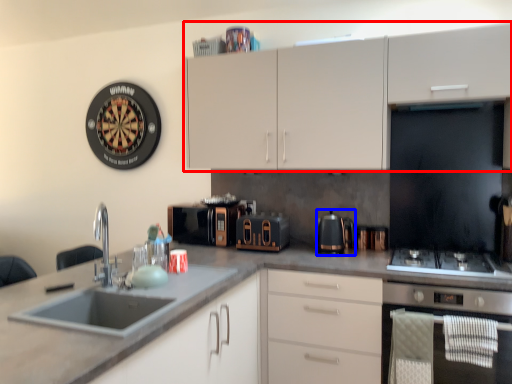
Question: Among these objects, which one is nearest to the camera, cabinetry (highlighted by a red box) or kitchen appliance (highlighted by a blue box)?

Choices:
 (A) cabinetry
 (B) kitchen appliance

Answer: (A)